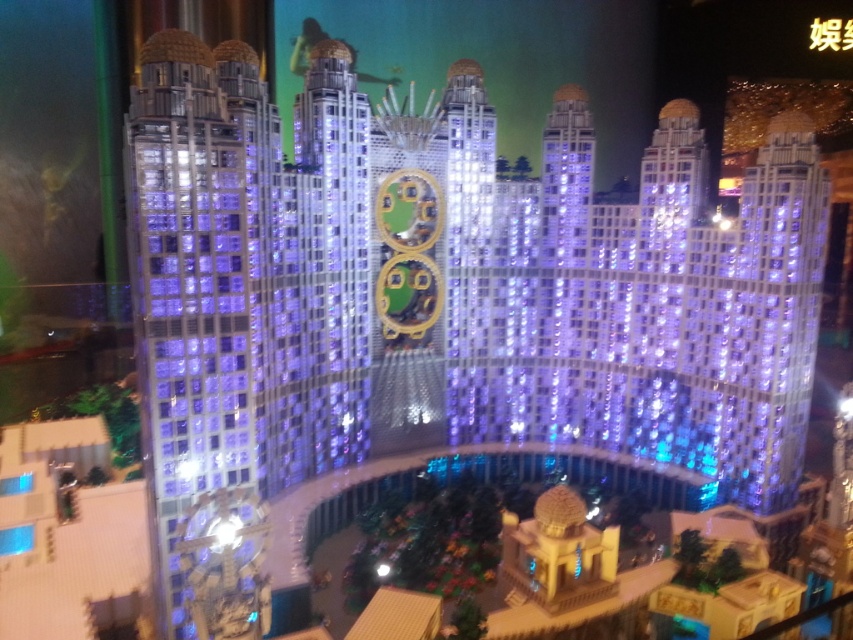
You are examining the miniature city model from above. There are two points marked in the scene. The first point is at coordinates point (158, 458) and the second is at point (740, 312). Which of these points is closer to your viewpoint?

Point (158, 458) is closer to the camera than point (740, 312).

You are an architect reviewing the model of this city. You need to determine the spatial relationship between the transparent glass tower at left and the lustrous glass skyscraper at right. Which one is positioned higher in the vertical plane?

The transparent glass tower at left is located above the lustrous glass skyscraper at right, meaning it is positioned higher vertically.